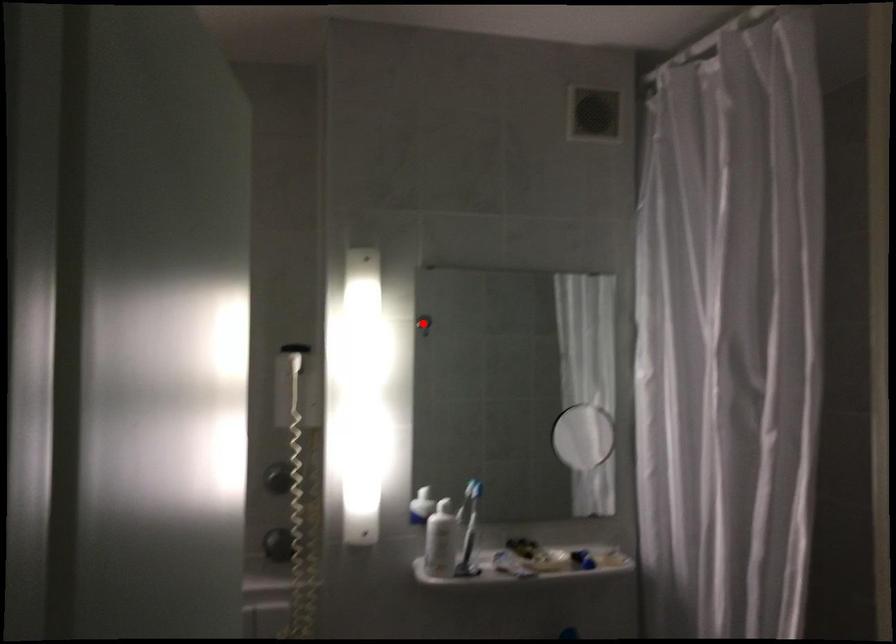
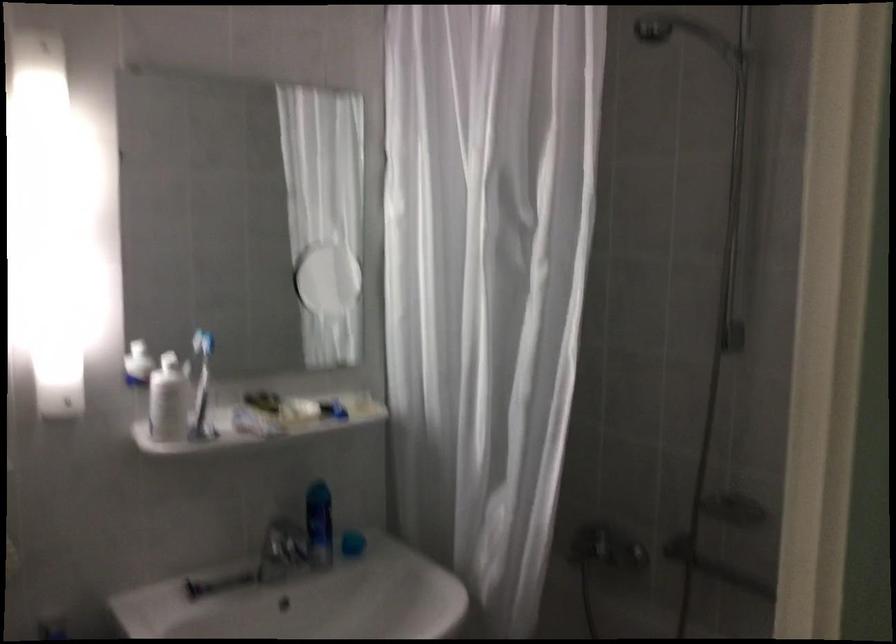
Question: A red point is marked in image1. In image2, is the corresponding 3D point closer to the camera or farther? Reply with the corresponding letter.

Choices:
 (A) The corresponding 3D point is closer.
 (B) The corresponding 3D point is farther.

Answer: (A)